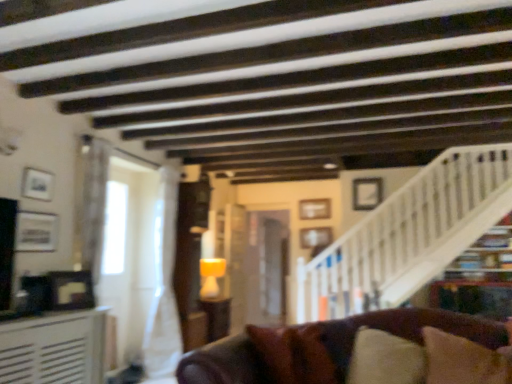
Measure the distance between wooden picture frame at center, arranged as the third picture frame when viewed from the left, and camera.

A distance of 5.12 meters exists between wooden picture frame at center, arranged as the third picture frame when viewed from the left, and camera.

What do you see at coordinates (164, 284) in the screenshot? I see `white sheer curtain at center` at bounding box center [164, 284].

Describe the element at coordinates (463, 360) in the screenshot. I see `brown fabric pillow at lower right` at that location.

Image resolution: width=512 pixels, height=384 pixels. What are the coordinates of `white matte picture frame at upper right, the 5th picture frame when ordered from left to right` in the screenshot? It's located at (367, 193).

Does wooden picture frame at center, the first picture frame viewed from the back, lie behind white textured table at left, which is the second table from bottom to top?

Yes, it is behind white textured table at left, which is the second table from bottom to top.

Could you tell me if wooden picture frame at center, arranged as the third picture frame when viewed from the left, is facing white textured table at left, the 1th table in the top-to-bottom sequence?

No.

Visually, is wooden picture frame at center, placed as the 3th picture frame when sorted from right to left, positioned to the left or to the right of white textured table at left, which is the second table in back-to-front order?

wooden picture frame at center, placed as the 3th picture frame when sorted from right to left, is positioned on white textured table at left, which is the second table in back-to-front order,'s right side.

Is wooden picture frame at center, placed as the 3th picture frame when sorted from right to left, thinner than white textured table at left, which is the second table from bottom to top?

Indeed, wooden picture frame at center, placed as the 3th picture frame when sorted from right to left, has a lesser width compared to white textured table at left, which is the second table from bottom to top.

Based on the photo, can you tell me how much wooden picture frame at center, the second picture frame viewed from the back, and brown leather couch at lower center differ in facing direction?

wooden picture frame at center, the second picture frame viewed from the back, and brown leather couch at lower center are facing 0.585 degrees away from each other.

From the image's perspective, would you say wooden picture frame at center, which is the second picture frame from right to left, is shown under brown leather couch at lower center?

Actually, wooden picture frame at center, which is the second picture frame from right to left, appears above brown leather couch at lower center in the image.

From the picture: Based on their positions, is wooden picture frame at center, positioned as the 4th picture frame in left-to-right order, located to the left or right of brown leather couch at lower center?

Based on their positions, wooden picture frame at center, positioned as the 4th picture frame in left-to-right order, is located to the right of brown leather couch at lower center.

From a real-world perspective, is wooden picture frame at center, positioned as the 4th picture frame in left-to-right order, on brown leather couch at lower center?

Yes, from a real-world perspective, wooden picture frame at center, positioned as the 4th picture frame in left-to-right order, is above brown leather couch at lower center.

From the image's perspective, is wooden picture frame at center, the first picture frame viewed from the back, below white matte picture frame at upper right, the third picture frame positioned from the back?

Yes, from the image's perspective, wooden picture frame at center, the first picture frame viewed from the back, is beneath white matte picture frame at upper right, the third picture frame positioned from the back.

Between point (328, 216) and point (379, 181), which one is positioned behind?

The point (379, 181) is farther.

From a real-world perspective, which object stands above the other?

white matte picture frame at upper right, the 5th picture frame when ordered from left to right, from a real-world perspective.

From the image's perspective, would you say matte silver picture frame at left, placed as the 5th picture frame when sorted from back to front, is shown under wooden picture frame at center, placed as the 3th picture frame when sorted from right to left?

Indeed, from the image's perspective, matte silver picture frame at left, placed as the 5th picture frame when sorted from back to front, is shown beneath wooden picture frame at center, placed as the 3th picture frame when sorted from right to left.

Between matte silver picture frame at left, the first picture frame viewed from the front, and wooden picture frame at center, placed as the 3th picture frame when sorted from right to left, which one has smaller size?

matte silver picture frame at left, the first picture frame viewed from the front.

Between point (31, 242) and point (306, 208), which one is positioned in front?

Point (31, 242)

Would you say matte silver picture frame at left, the 4th picture frame in the right-to-left sequence, is outside wooden picture frame at center, arranged as the third picture frame when viewed from the left?

Yes, matte silver picture frame at left, the 4th picture frame in the right-to-left sequence, is not within wooden picture frame at center, arranged as the third picture frame when viewed from the left.

From a real-world perspective, which is physically below, brown fabric pillow at lower right or wooden picture frame at center, which is the fourth picture frame from front to back?

brown fabric pillow at lower right.

Is brown fabric pillow at lower right oriented towards wooden picture frame at center, positioned as the 4th picture frame in left-to-right order?

No, brown fabric pillow at lower right does not turn towards wooden picture frame at center, positioned as the 4th picture frame in left-to-right order.

Considering their positions, is brown fabric pillow at lower right located in front of or behind wooden picture frame at center, which is the fourth picture frame from front to back?

brown fabric pillow at lower right is positioned closer to the viewer than wooden picture frame at center, which is the fourth picture frame from front to back.

In the scene shown: Which object is thinner, brown fabric pillow at lower right or wooden picture frame at center, which is the second picture frame from right to left?

wooden picture frame at center, which is the second picture frame from right to left.

In the scene shown: Could you tell me if wooden picture frame at center, the second picture frame viewed from the back, is facing white wooden stairwell at upper right?

Yes, wooden picture frame at center, the second picture frame viewed from the back, is facing white wooden stairwell at upper right.

Is wooden picture frame at center, positioned as the 4th picture frame in left-to-right order, bigger than white wooden stairwell at upper right?

No, wooden picture frame at center, positioned as the 4th picture frame in left-to-right order, is not bigger than white wooden stairwell at upper right.

In the scene shown: How much distance is there between wooden picture frame at center, which is the second picture frame from right to left, and white wooden stairwell at upper right?

wooden picture frame at center, which is the second picture frame from right to left, and white wooden stairwell at upper right are 34.73 inches apart from each other.

Does white matte picture frame at upper right, the 5th picture frame when ordered from left to right, have a smaller size compared to brown fabric pillow at lower right?

Correct, white matte picture frame at upper right, the 5th picture frame when ordered from left to right, occupies less space than brown fabric pillow at lower right.

Which point is more distant from viewer, (362, 206) or (510, 361)?

The point (362, 206) is farther.

From a real-world perspective, is white matte picture frame at upper right, the third picture frame positioned from the back, physically located above or below brown fabric pillow at lower right?

From a real-world perspective, white matte picture frame at upper right, the third picture frame positioned from the back, is physically above brown fabric pillow at lower right.

Locate an element on the screen. the 1st table located beneath the wooden picture frame at center, placed as the 3th picture frame when sorted from right to left (from a real-world perspective) is located at coordinates (54, 349).

Locate an element on the screen. picture frame that is the 2nd one above the brown leather couch at lower center (from a real-world perspective) is located at coordinates (315, 237).

Which object lies nearer to the anchor point matte silver picture frame at left, placed as the 5th picture frame when sorted from back to front, white matte picture frame at upper right, which is the first picture frame from right to left, or white textured table at left, which is the second table from bottom to top?

The object closer to matte silver picture frame at left, placed as the 5th picture frame when sorted from back to front, is white textured table at left, which is the second table from bottom to top.

When comparing their distances from matte orange lampshade at center, does white matte picture frame at upper right, which is the first picture frame from right to left, or brown leather couch at lower center seem closer?

white matte picture frame at upper right, which is the first picture frame from right to left, is positioned closer to the anchor matte orange lampshade at center.

When comparing their distances from matte silver picture frame at left, marked as the 2th picture frame in a left-to-right arrangement, does white sheer curtain at center or white matte picture frame at upper right, the third picture frame positioned from the back, seem closer?

Among the two, white sheer curtain at center is located nearer to matte silver picture frame at left, marked as the 2th picture frame in a left-to-right arrangement.

Looking at the image, which one is located further to white sheer curtain at center, wooden picture frame at center, the 5th picture frame from the front, or matte silver picture frame at left, the first picture frame viewed from the front?

wooden picture frame at center, the 5th picture frame from the front, is further to white sheer curtain at center.

Which object lies further to the anchor point white matte picture frame at upper right, the third picture frame positioned from the back, matte brown table at center, the 2th table in the top-to-bottom sequence, or wooden picture frame at center, arranged as the third picture frame when viewed from the left?

matte brown table at center, the 2th table in the top-to-bottom sequence, lies further to white matte picture frame at upper right, the third picture frame positioned from the back, than the other object.

Looking at the image, which one is located further to matte silver picture frame at left, placed as the 5th picture frame when sorted from back to front, white sheer curtain at center or matte brown table at center, arranged as the 1th table when ordered from the bottom?

matte brown table at center, arranged as the 1th table when ordered from the bottom.

From the image, which object appears to be farther from matte brown table at center, which is counted as the second table, starting from the left, wooden picture frame at center, which is the fourth picture frame from front to back, or matte white picture frame at upper left, which is the 5th picture frame in right-to-left order?

matte white picture frame at upper left, which is the 5th picture frame in right-to-left order, lies further to matte brown table at center, which is counted as the second table, starting from the left, than the other object.

Which object lies nearer to the anchor point white matte picture frame at upper right, which is the first picture frame from right to left, white wooden stairwell at upper right or white textured table at left, which is the second table from bottom to top?

Based on the image, white wooden stairwell at upper right appears to be nearer to white matte picture frame at upper right, which is the first picture frame from right to left.

Where is `lamp between matte silver picture frame at left, placed as the 5th picture frame when sorted from back to front, and white wooden stairwell at upper right`? This screenshot has width=512, height=384. lamp between matte silver picture frame at left, placed as the 5th picture frame when sorted from back to front, and white wooden stairwell at upper right is located at coordinates (211, 276).

What are the coordinates of `table between matte white picture frame at upper left, placed as the 4th picture frame when sorted from back to front, and wooden picture frame at center, placed as the 3th picture frame when sorted from right to left, from front to back` in the screenshot? It's located at (216, 316).

This screenshot has height=384, width=512. I want to click on table located between matte silver picture frame at left, the 4th picture frame in the right-to-left sequence, and wooden picture frame at center, which is the fourth picture frame from front to back, in the depth direction, so click(216, 316).

You are a GUI agent. You are given a task and a screenshot of the screen. Output one action in this format:
    pyautogui.click(x=<x>, y=<y>)
    Task: Click on the picture frame between white wooden stairwell at upper right and wooden picture frame at center, positioned as the 4th picture frame in left-to-right order, from front to back
    Image resolution: width=512 pixels, height=384 pixels.
    Given the screenshot: What is the action you would take?
    pyautogui.click(x=367, y=193)